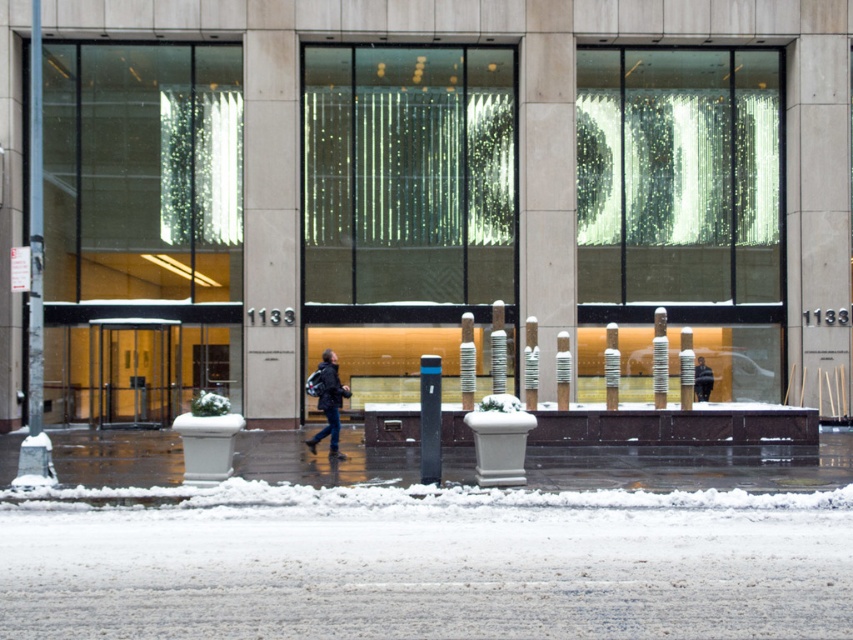
You are standing on the sidewalk in front of the modern building. You see the white snow at lower center and the dark gray jacket at center. Which object is located to the left of the other?

The white snow at lower center is positioned on the left side of dark gray jacket at center.

You are standing on the snowy sidewalk in front of the modern building. You see a person wearing dark blue jeans at center and dark gray jacket at center. Which part of their clothing is closer to you?

The dark blue jeans at center is closer to the viewer than the dark gray jacket at center.

You are standing at the point with coordinates point (39, 545) and want to walk towards the point with coordinates point (703, 369). Which direction should you move relative to the other point?

You should move towards the point (703, 369), which is behind the point (39, 545). Since point (39, 545) is in front of point (703, 369), you need to walk backward to reach the desired point.